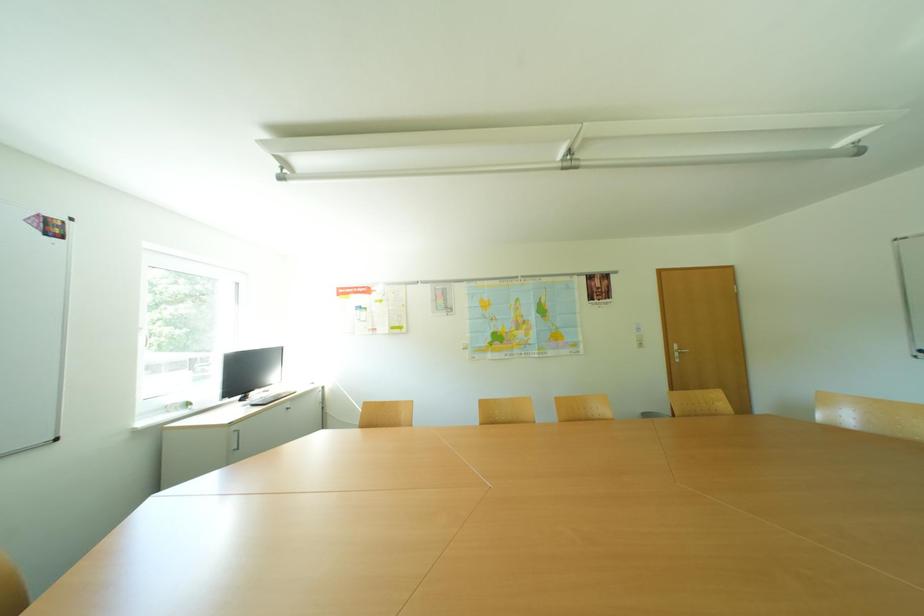
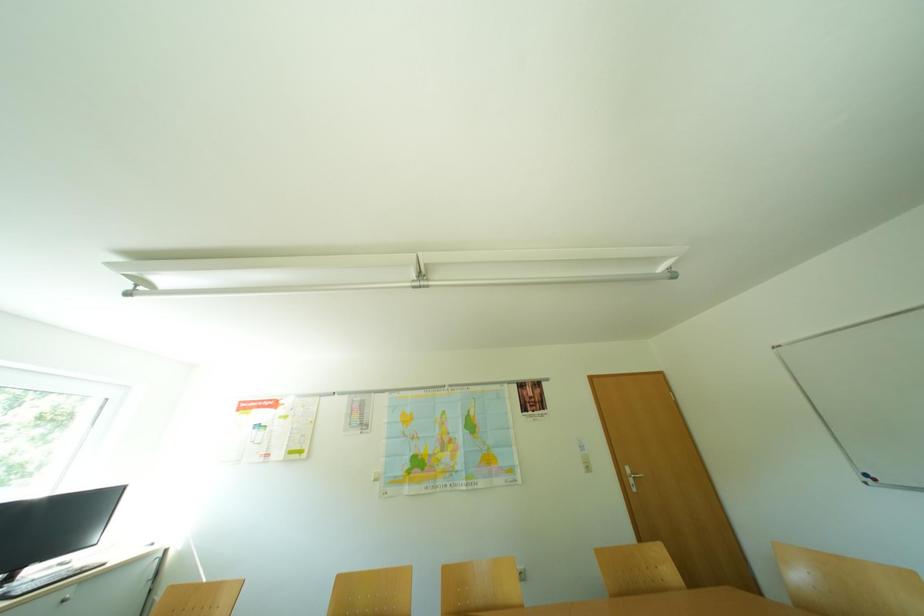
Question: The images are taken continuously from a first-person perspective. In which direction are you moving?

Choices:
 (A) Left
 (B) Right
 (C) Forward
 (D) Backward

Answer: (B)